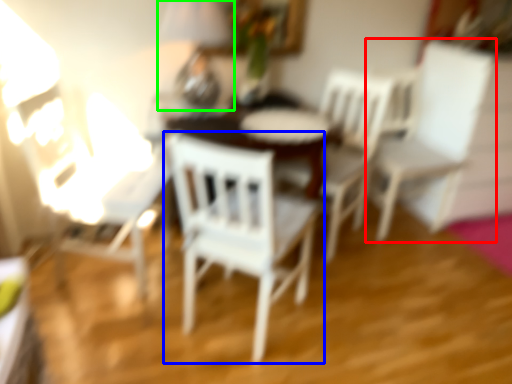
Question: Based on their relative distances, which object is nearer to chair (highlighted by a red box)? Choose from chair (highlighted by a blue box) and table lamp (highlighted by a green box).

Choices:
 (A) chair
 (B) table lamp

Answer: (A)